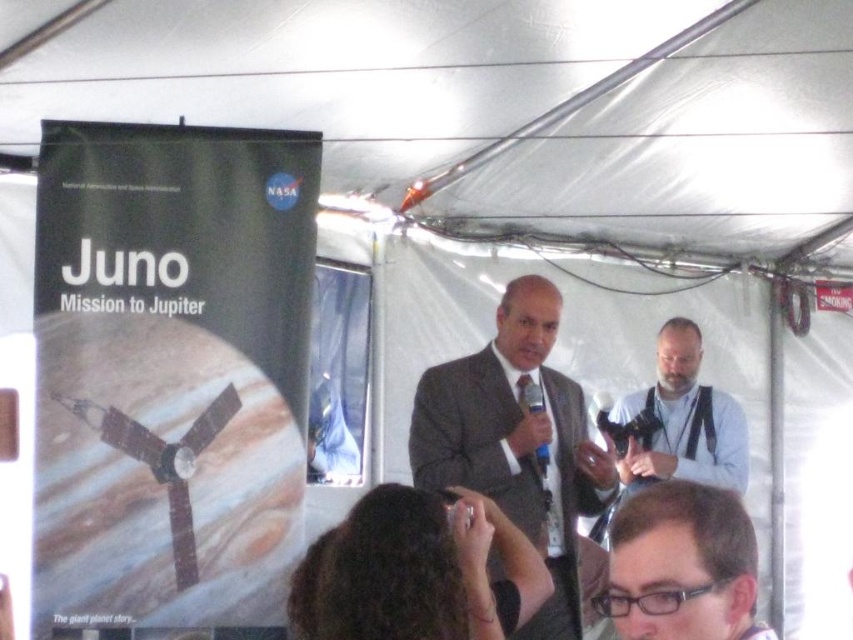
Question: Does clear plastic glasses at center appear under gray fabric camera at center?

Choices:
 (A) no
 (B) yes

Answer: (A)

Question: Which of the following is the closest to the observer?

Choices:
 (A) clear plastic glasses at center
 (B) matte gray suit at center

Answer: (A)

Question: Which point is farther to the camera?

Choices:
 (A) clear plastic glasses at center
 (B) gray fabric camera at center

Answer: (B)

Question: Is matte gray suit at center positioned before clear plastic glasses at center?

Choices:
 (A) no
 (B) yes

Answer: (A)

Question: Based on their relative distances, which object is nearer to the matte gray suit at center?

Choices:
 (A) gray fabric camera at center
 (B) clear plastic glasses at center

Answer: (A)

Question: Where is clear plastic glasses at center located in relation to gray fabric camera at center in the image?

Choices:
 (A) below
 (B) above

Answer: (B)